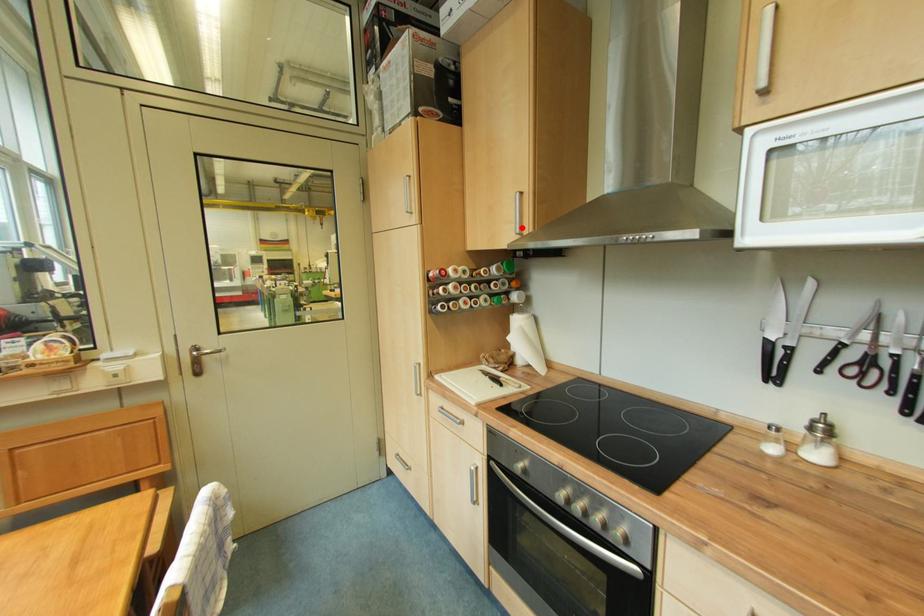
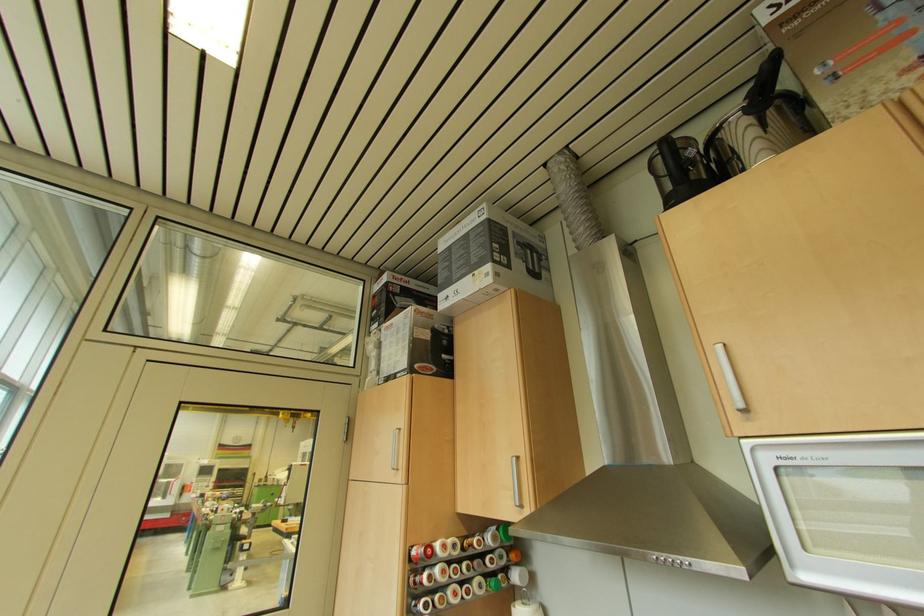
Where in the second image is the point corresponding to the highlighted location from the first image?

(519, 496)